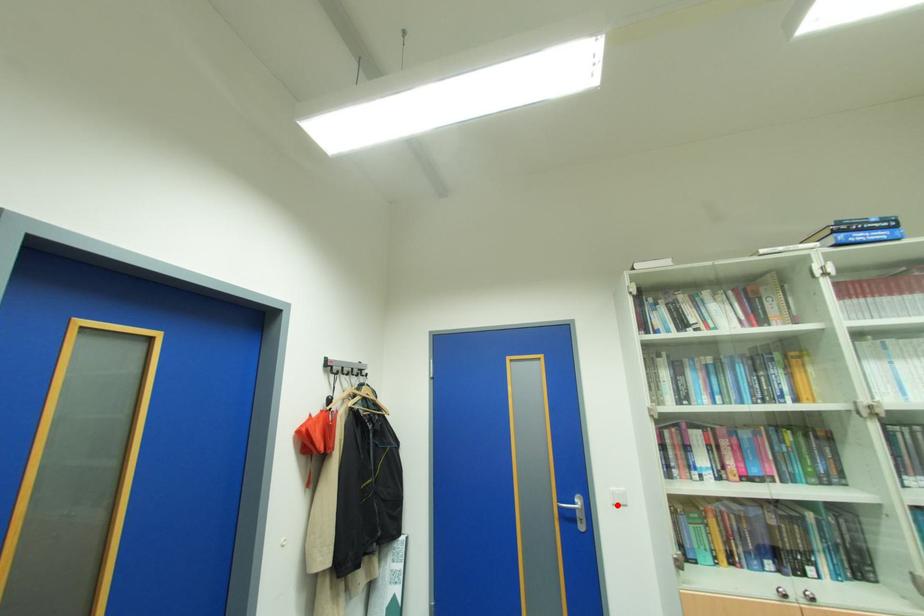
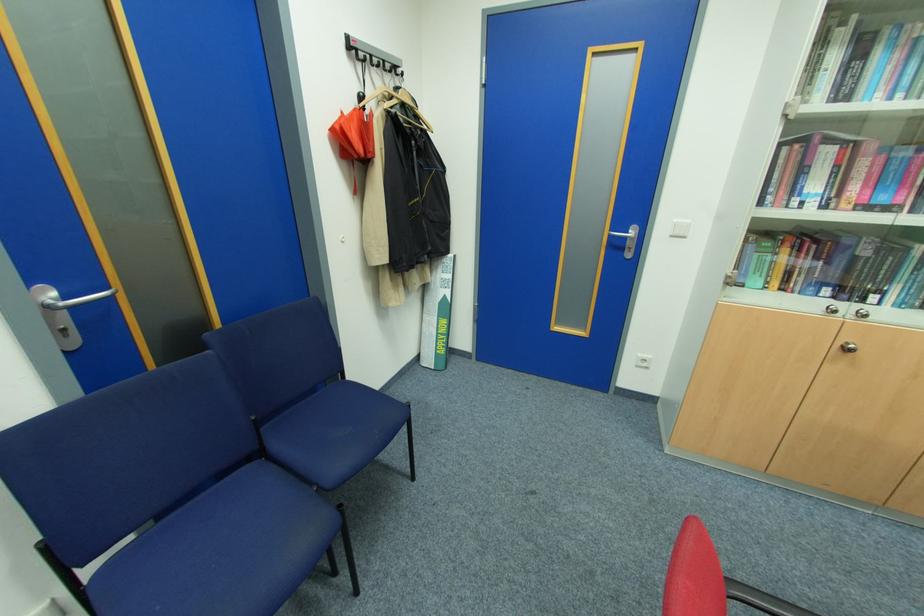
Question: I am providing you with two images of the same scene from different viewpoints. Given a red point in image1, look at the same physical point in image2. Is it:

Choices:
 (A) Closer to the viewpoint
 (B) Farther from the viewpoint

Answer: (A)